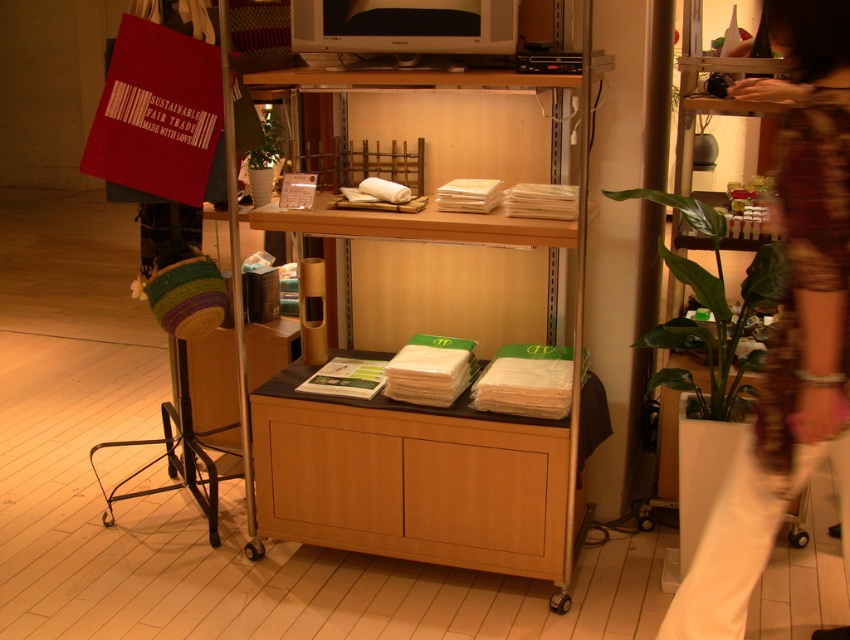
Does wooden bracelet at lower right have a larger size compared to green leafy plant at center?

Indeed, wooden bracelet at lower right has a larger size compared to green leafy plant at center.

Which is more to the right, wooden bracelet at lower right or green leafy plant at center?

From the viewer's perspective, wooden bracelet at lower right appears more on the right side.

This screenshot has height=640, width=850. What do you see at coordinates (789, 332) in the screenshot? I see `wooden bracelet at lower right` at bounding box center [789, 332].

Locate an element on the screen. The image size is (850, 640). wooden bracelet at lower right is located at coordinates point(789,332).

Does wooden bracelet at lower right have a greater height compared to green leafy plant at right?

Correct, wooden bracelet at lower right is much taller as green leafy plant at right.

Is wooden bracelet at lower right below green leafy plant at right?

Indeed, wooden bracelet at lower right is positioned under green leafy plant at right.

Which is in front, point (792, 132) or point (758, 369)?

Point (792, 132) is more forward.

This screenshot has width=850, height=640. What are the coordinates of `wooden bracelet at lower right` in the screenshot? It's located at (789, 332).

Is wooden cabinet at center wider than green leafy plant at right?

Yes.

Is point (497, 538) positioned before point (652, 326)?

Yes, it is.

What do you see at coordinates (409, 480) in the screenshot?
I see `wooden cabinet at center` at bounding box center [409, 480].

The image size is (850, 640). In order to click on wooden cabinet at center in this screenshot , I will do (409, 480).